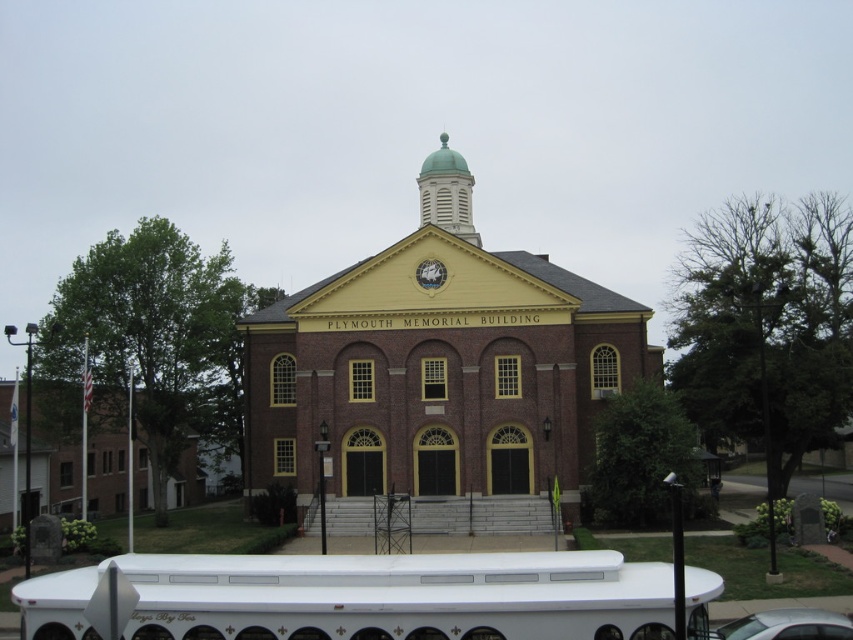
Question: In this image, where is brick/yellow paint church at center located relative to silver metallic car at lower right?

Choices:
 (A) below
 (B) above

Answer: (B)

Question: Can you confirm if brick/yellow paint church at center is wider than silver metallic car at lower right?

Choices:
 (A) yes
 (B) no

Answer: (A)

Question: Which of the following is the closest to the observer?

Choices:
 (A) brick/yellow paint church at center
 (B) silver metallic car at lower right

Answer: (B)

Question: Can you confirm if brick/yellow paint church at center is positioned to the left of silver metallic car at lower right?

Choices:
 (A) yes
 (B) no

Answer: (A)

Question: Which of the following is the closest to the observer?

Choices:
 (A) brick/yellow paint church at center
 (B) silver metallic car at lower right

Answer: (B)